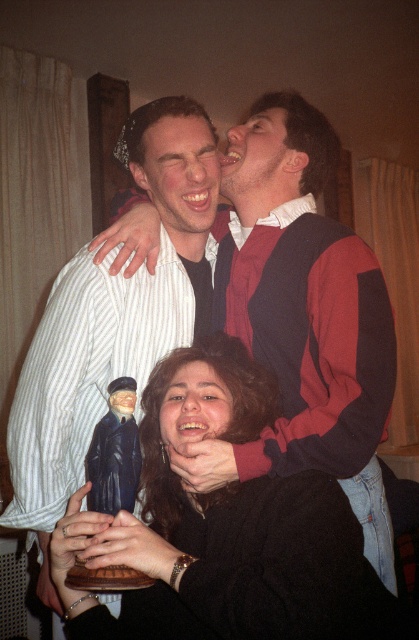
You are a photographer trying to capture a candid shot of the matte black sweater at center and the matte white face at center. Which object should you focus on first if you want to capture both in the same frame without moving the camera?

You should focus on the matte white face at center first because the matte black sweater at center is positioned to its right, so adjusting focus from the matte white face at center to the right will include both in the frame.

You are a photographer who wants to take a portrait of the two people in the scene. The camera you are using has a shallow depth of field that blurs objects farther away. If you focus on the matte black sweater at center, will the matte white face at center be blurred?

The matte black sweater at center is closer to the viewer than the matte white face at center. Since the camera has a shallow depth of field, focusing on the matte black sweater at center would blur the matte white face at center, which is farther away.

You are an interior designer planning to place a new lamp in this room. The lamp must be placed at the coordinates where the matte black figurine at center is currently located. What object currently occupies that location?

The matte black figurine at center is currently occupying the coordinates at point (217, 525).